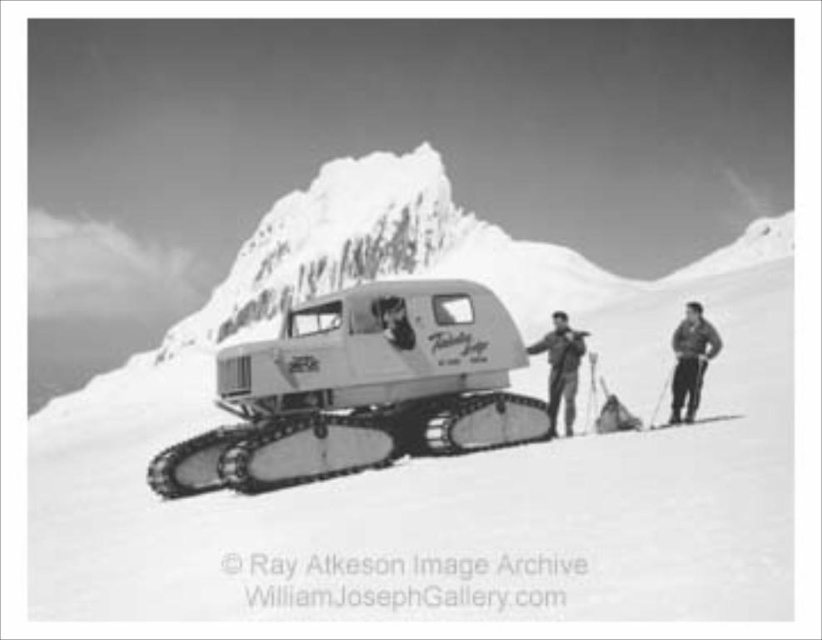
Question: Based on their relative distances, which object is farther from the metallic silver tracked vehicle at center?

Choices:
 (A) dark gray fabric jacket at center
 (B) white matte snow at center

Answer: (B)

Question: Does white matte snow at center have a greater width compared to dark gray fabric jacket at center?

Choices:
 (A) no
 (B) yes

Answer: (B)

Question: Which point is closer to the camera taking this photo?

Choices:
 (A) (668, 420)
 (B) (560, 323)
 (C) (158, 616)

Answer: (C)

Question: Which of the following is the farthest from the observer?

Choices:
 (A) (696, 339)
 (B) (556, 388)
 (C) (388, 308)
 (D) (322, 474)

Answer: (B)

Question: Is snowy white mountain at center below smooth fur coat at center?

Choices:
 (A) no
 (B) yes

Answer: (A)

Question: Does snowy white mountain at center have a larger size compared to dark gray fabric jacket at right?

Choices:
 (A) yes
 (B) no

Answer: (A)